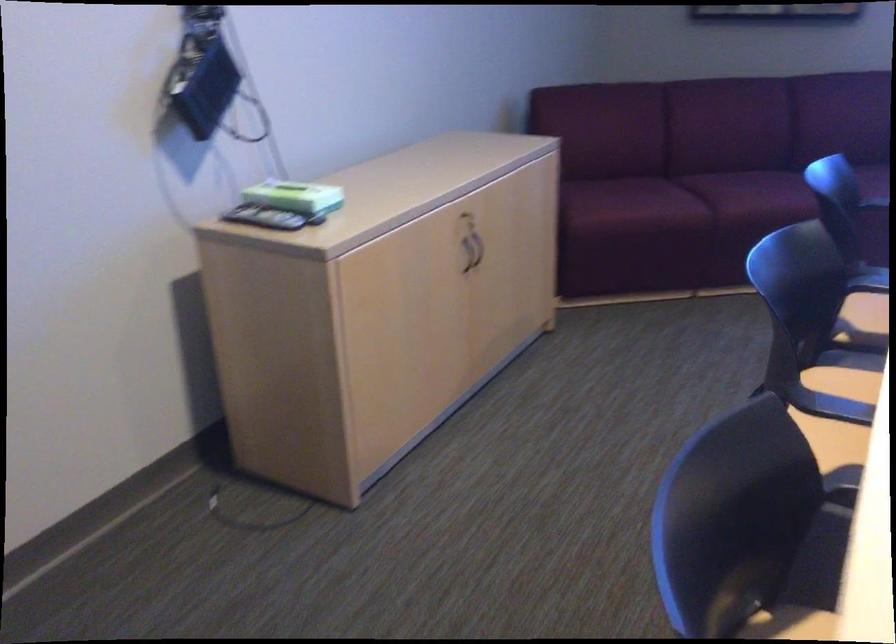
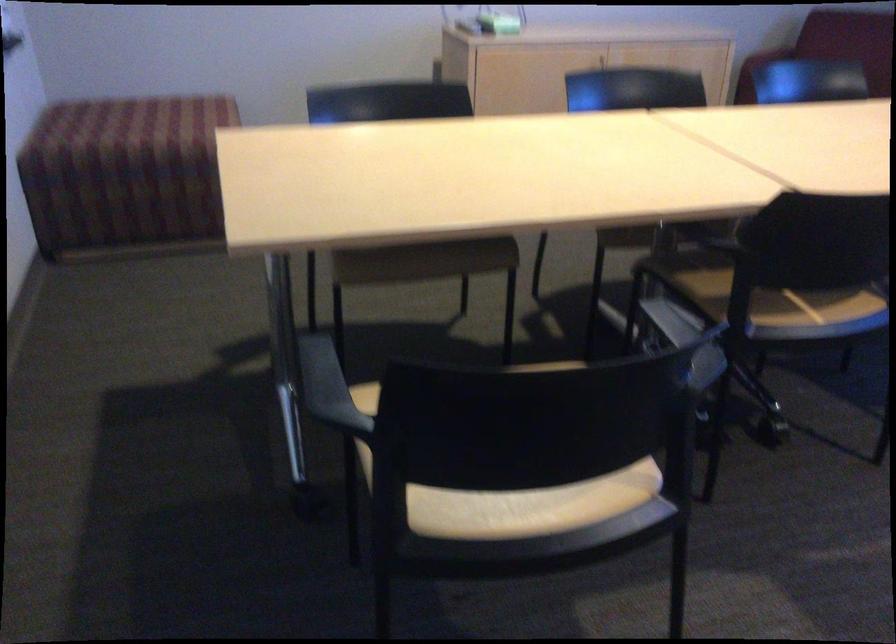
Question: I am providing you with two images of the same scene from different viewpoints. Which of the following objects are not visible in image2?

Choices:
 (A) black flower pot
 (B) black chair armrest
 (C) light chair sitting surface
 (D) chair sitting surface

Answer: (D)